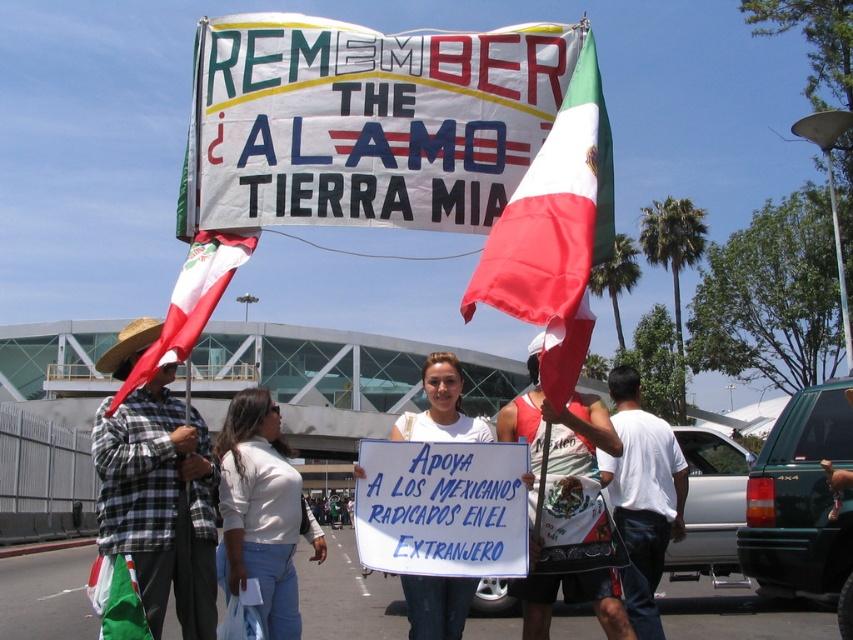
You are a photographer standing in front of the white fabric flag at center and the checkered fabric shirt at left. Which object is nearer to you?

The white fabric flag at center is closer to the viewer than the checkered fabric shirt at left.

You are a photographer at the protest. You need to capture a photo where both the checkered fabric shirt at left and the red fabric flag at center are visible. Based on their heights, which object should be placed closer to the camera to ensure both are fully visible in the frame?

The checkered fabric shirt at left is taller than the red fabric flag at center. To ensure both are fully visible in the frame, the red fabric flag at center should be placed closer to the camera since it is shorter, allowing the taller shirt to still be captured without being cropped.